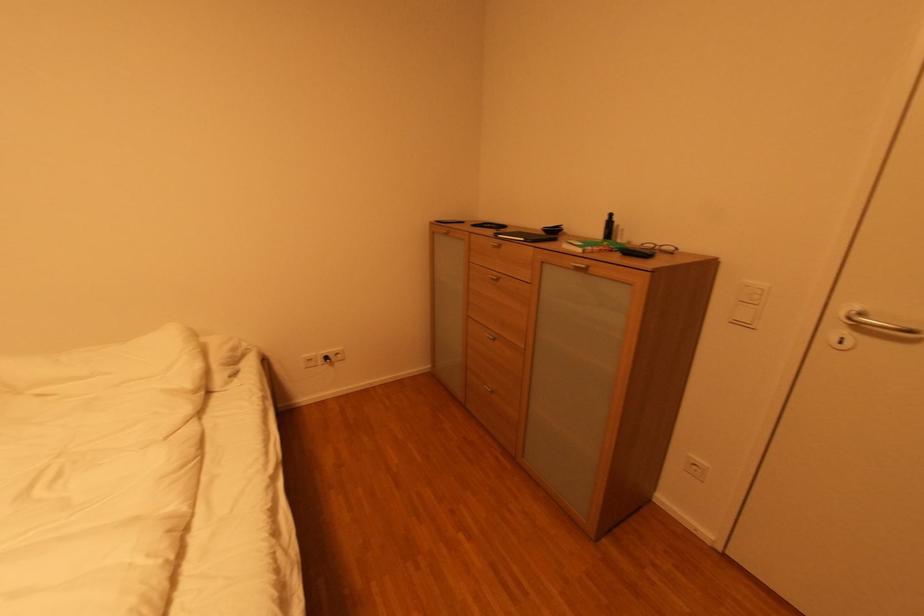
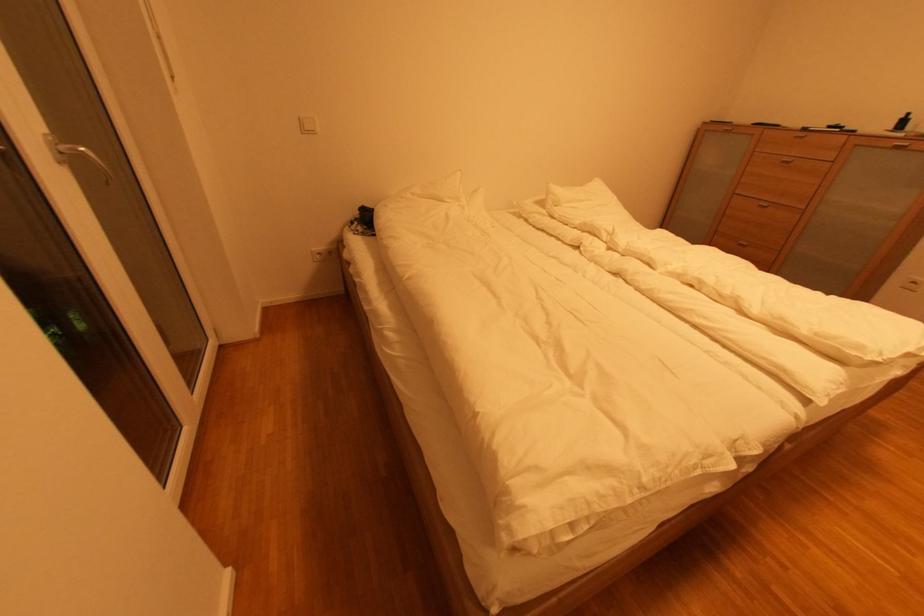
The point at (613, 219) is marked in the first image. Where is the corresponding point in the second image?

(908, 118)